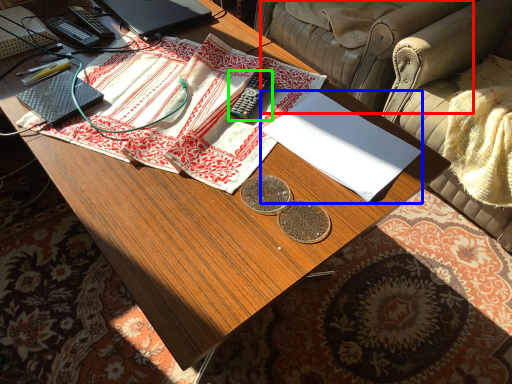
Question: Estimate the real-world distances between objects in this image. Which object is closer to armchair (highlighted by a red box), notebook (highlighted by a blue box) or remote control (highlighted by a green box)?

Choices:
 (A) notebook
 (B) remote control

Answer: (B)